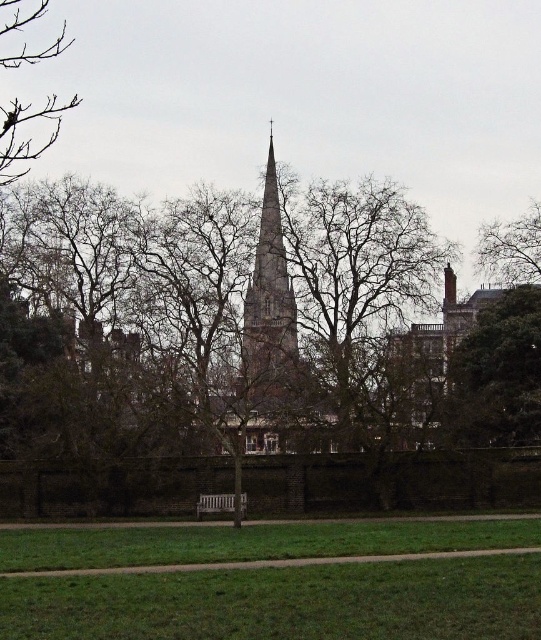
You are planning to take a photo of the green leafy tree at right and the brown brick steeple at center. Which object should you focus on first if you want to capture both in a single frame without moving the camera?

The green leafy tree at right is positioned under the brown brick steeple at center, so you should focus on the brown brick steeple at center first to ensure both are in the frame.

You are a gardener who wants to plant flowers in the green grass at lower center and the brown brick steeple at center. Which area has enough space for a large flower bed?

The green grass at lower center has a larger size compared to the brown brick steeple at center, so it has enough space for a large flower bed.